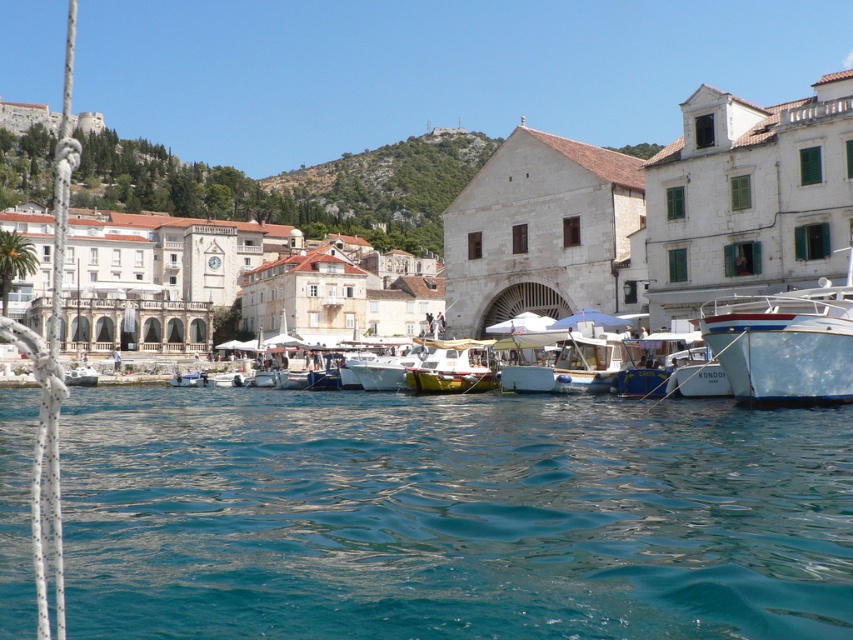
Does clear blue water at center have a smaller size compared to yellow matte boat at center?

No, clear blue water at center is not smaller than yellow matte boat at center.

Find the location of a particular element. The width and height of the screenshot is (853, 640). clear blue water at center is located at coordinates (451, 515).

Where is `clear blue water at center`? clear blue water at center is located at coordinates (451, 515).

I want to click on clear blue water at center, so click(451, 515).

Between white glossy boat at right and yellow matte boat at center, which one appears on the right side from the viewer's perspective?

white glossy boat at right

Is point (740, 317) positioned after point (416, 369)?

No, it is not.

Who is more forward, (842, 362) or (440, 376)?

Point (842, 362)

This screenshot has width=853, height=640. What are the coordinates of `white glossy boat at right` in the screenshot? It's located at (785, 342).

Does clear blue water at center appear on the left side of white stone building at center?

No, clear blue water at center is not to the left of white stone building at center.

Who is more forward, (437, 620) or (466, 272)?

Point (437, 620) is in front.

What do you see at coordinates (451, 515) in the screenshot?
I see `clear blue water at center` at bounding box center [451, 515].

Where is `clear blue water at center`? clear blue water at center is located at coordinates (451, 515).